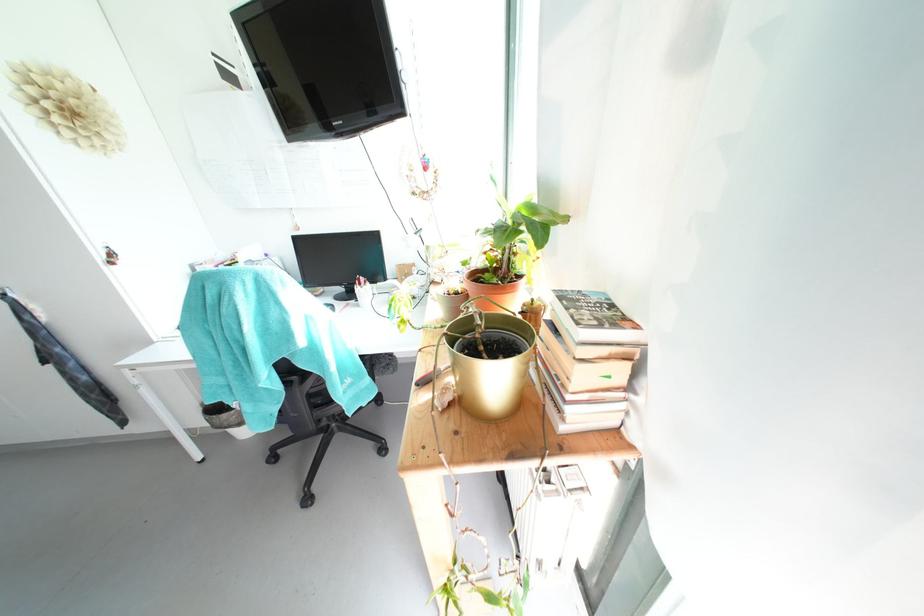
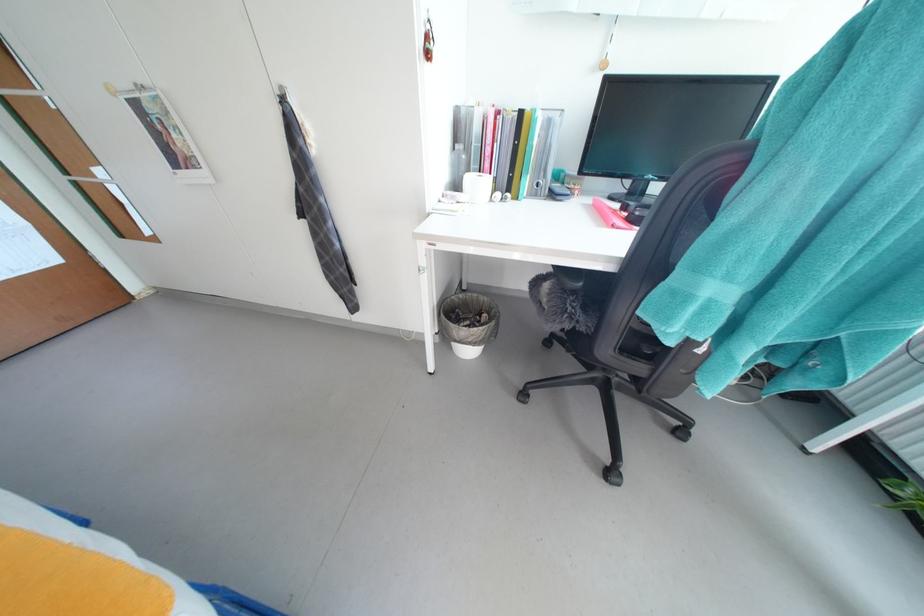
Locate, in the second image, the point that corresponds to (234,426) in the first image.

(478, 342)